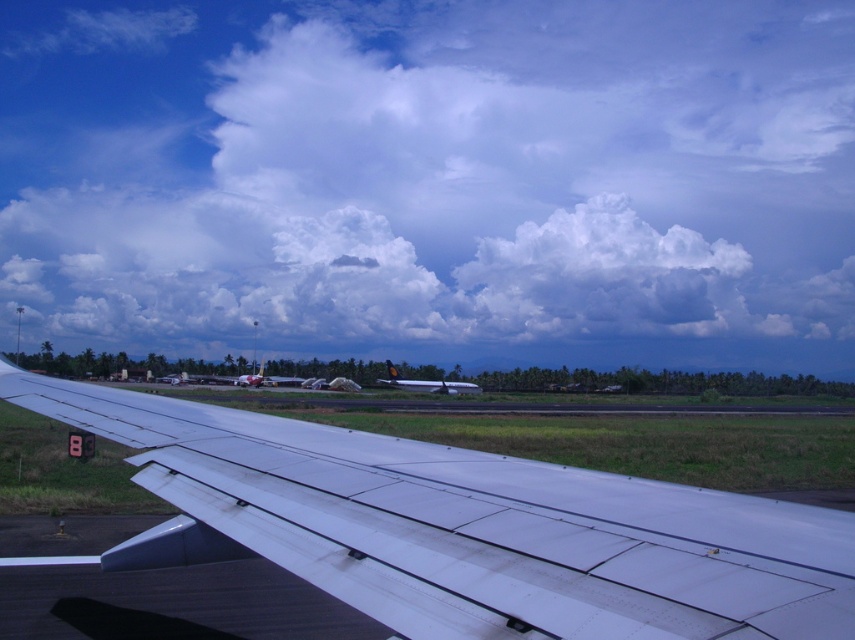
Can you confirm if white fluffy cloud at upper center is positioned above matte white airplane at center?

Indeed, white fluffy cloud at upper center is positioned over matte white airplane at center.

Who is higher up, white fluffy cloud at upper center or matte white airplane at center?

Positioned higher is white fluffy cloud at upper center.

Between point (671, 280) and point (198, 378), which one is positioned behind?

Point (671, 280)

Find the location of a particular element. Image resolution: width=855 pixels, height=640 pixels. white fluffy cloud at upper center is located at coordinates (432, 179).

Describe the element at coordinates (469, 528) in the screenshot. I see `white matte wing at center` at that location.

Can you confirm if white matte wing at center is thinner than metallic silver airplane at center?

Correct, white matte wing at center's width is less than metallic silver airplane at center's.

Does point (643, 500) come behind point (446, 381)?

No, (643, 500) is closer to viewer.

You are a GUI agent. You are given a task and a screenshot of the screen. Output one action in this format:
    pyautogui.click(x=<x>, y=<y>)
    Task: Click on the white matte wing at center
    
    Given the screenshot: What is the action you would take?
    pyautogui.click(x=469, y=528)

Who is shorter, white matte wing at center or matte white airplane at center?

Standing shorter between the two is white matte wing at center.

At what (x,y) coordinates should I click in order to perform the action: click on white matte wing at center. Please return your answer as a coordinate pair (x, y). Looking at the image, I should click on (469, 528).

Which is behind, point (600, 566) or point (264, 369)?

Positioned behind is point (264, 369).

Find the location of a particular element. The image size is (855, 640). white matte wing at center is located at coordinates (469, 528).